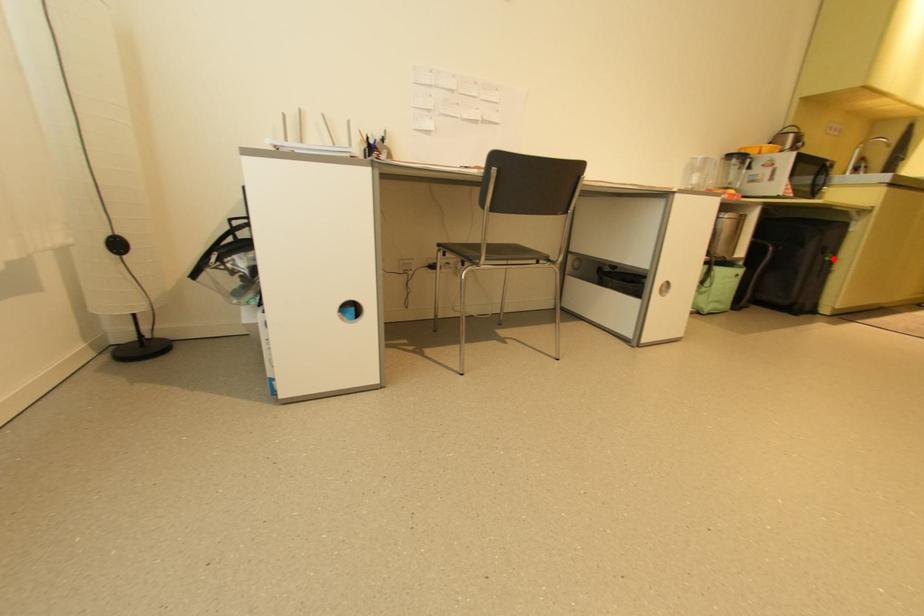
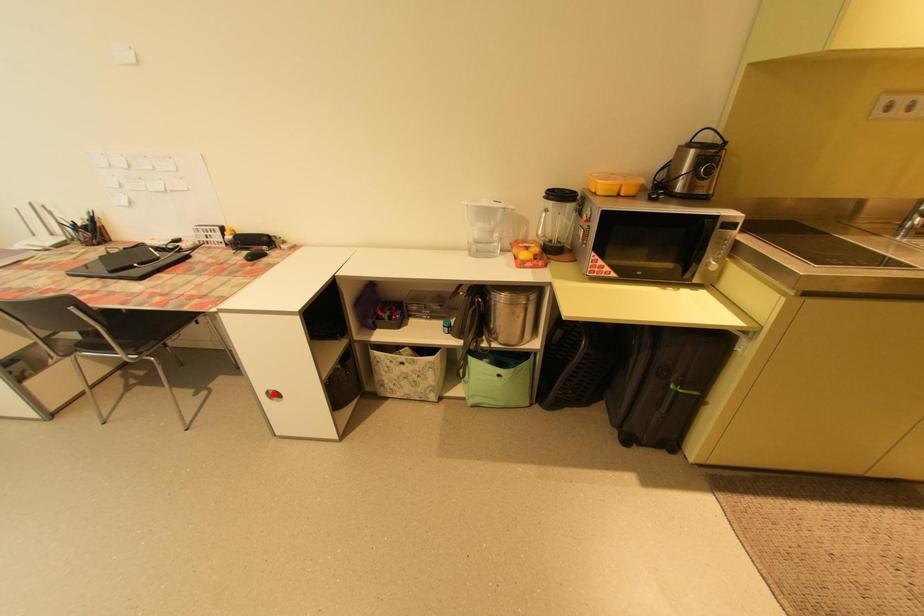
I am providing you with two images of the same scene from different viewpoints. A red point is marked on the first image and another point is marked on the second image. Are the points marked in image1 and image2 representing the same 3D position?

No